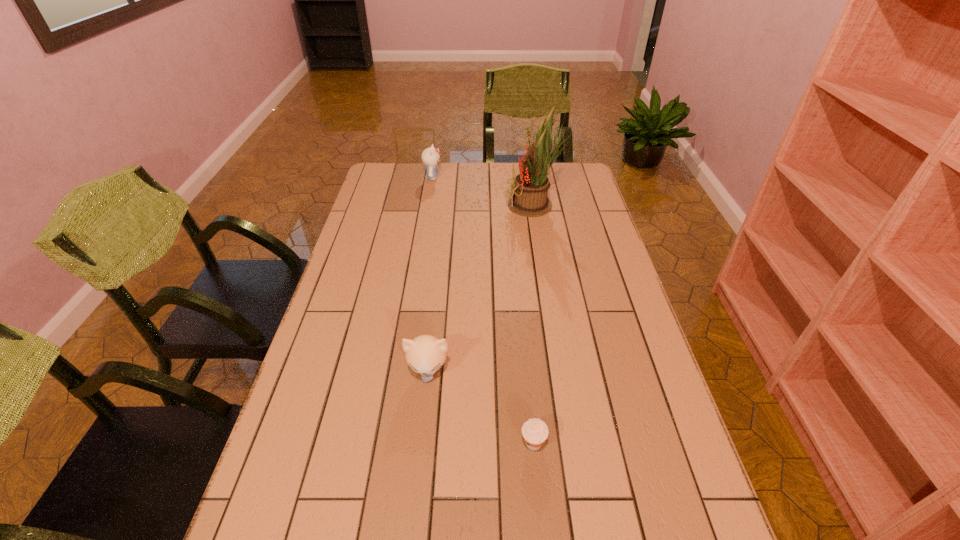
Identify which object is the third nearest to the flower arrangement. Please provide its 2D coordinates. Your answer should be formatted as a tuple, i.e. [(x, y)], where the tuple contains the x and y coordinates of a point satisfying the conditions above.

[(535, 432)]

This screenshot has height=540, width=960. What are the coordinates of `object identified as the second closest to the flower arrangement` in the screenshot? It's located at (425, 354).

Identify the location of vacant region that satisfies the following two spatial constraints: 1. on the front-facing side of the farther kitten; 2. on the left side of the muffin. This screenshot has height=540, width=960. (391, 443).

Find the location of a particular element. free spot that satisfies the following two spatial constraints: 1. on the front-facing side of the shortest object; 2. on the right side of the farthest object is located at coordinates (391, 443).

Identify the location of vacant space that satisfies the following two spatial constraints: 1. on the front-facing side of the farthest object; 2. on the back side of the muffin. The image size is (960, 540). (391, 443).

Image resolution: width=960 pixels, height=540 pixels. I want to click on free space that satisfies the following two spatial constraints: 1. on the face of the third farthest object; 2. on the left side of the nearest object, so click(x=420, y=443).

The width and height of the screenshot is (960, 540). Identify the location of free space that satisfies the following two spatial constraints: 1. on the back side of the nearest object; 2. on the front-facing side of the farthest object. (508, 178).

Identify the location of vacant space that satisfies the following two spatial constraints: 1. on the front-facing side of the shortest object; 2. on the right side of the farther kitten. This screenshot has height=540, width=960. (391, 443).